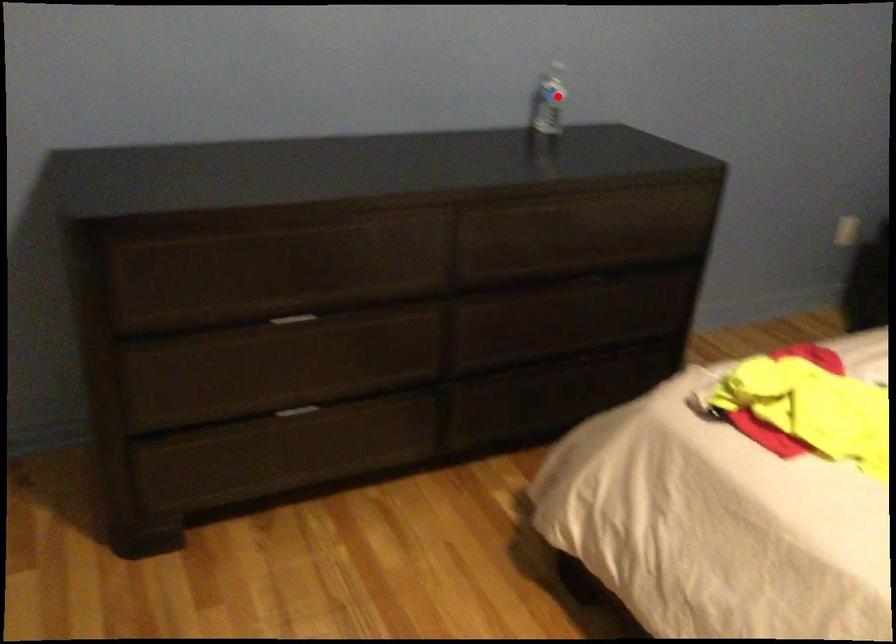
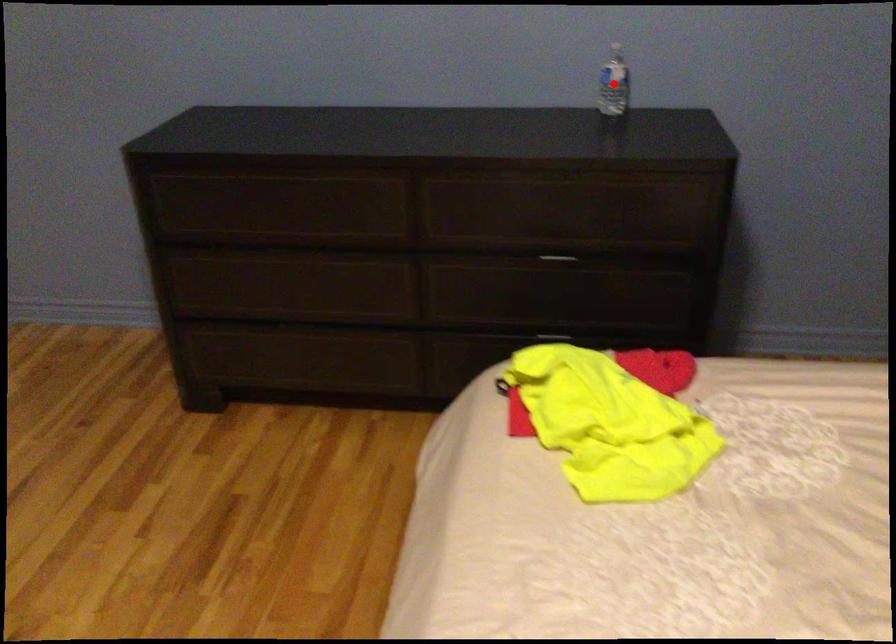
I am providing you with two images of the same scene from different viewpoints. A red point is marked on the first image and another point is marked on the second image. Does the point marked in image1 correspond to the same location as the one in image2?

Yes